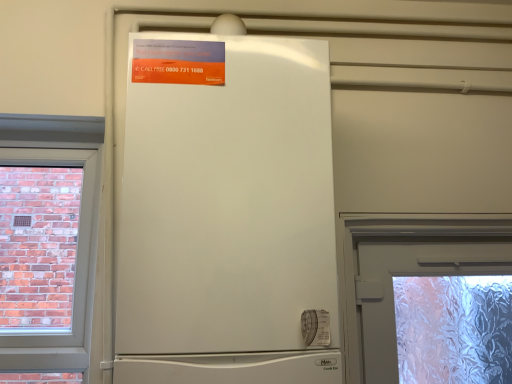
Question: Is white matte refrigerator at center positioned beyond the bounds of orange glossy poster at upper center?

Choices:
 (A) yes
 (B) no

Answer: (A)

Question: From the image's perspective, is white matte refrigerator at center located beneath orange glossy poster at upper center?

Choices:
 (A) no
 (B) yes

Answer: (B)

Question: Considering the relative sizes of white matte refrigerator at center and orange glossy poster at upper center in the image provided, is white matte refrigerator at center taller than orange glossy poster at upper center?

Choices:
 (A) no
 (B) yes

Answer: (B)

Question: Is white matte refrigerator at center further to camera compared to orange glossy poster at upper center?

Choices:
 (A) no
 (B) yes

Answer: (A)

Question: Can you confirm if white matte refrigerator at center is wider than orange glossy poster at upper center?

Choices:
 (A) yes
 (B) no

Answer: (A)

Question: Would you say orange glossy poster at upper center is part of white matte refrigerator at center's contents?

Choices:
 (A) yes
 (B) no

Answer: (A)

Question: From a real-world perspective, is orange glossy poster at upper center physically above white matte refrigerator at center?

Choices:
 (A) no
 (B) yes

Answer: (B)

Question: Can you confirm if orange glossy poster at upper center is positioned to the right of white matte refrigerator at center?

Choices:
 (A) yes
 (B) no

Answer: (B)

Question: Does orange glossy poster at upper center have a greater height compared to white matte refrigerator at center?

Choices:
 (A) yes
 (B) no

Answer: (B)

Question: Is orange glossy poster at upper center positioned far away from white matte refrigerator at center?

Choices:
 (A) no
 (B) yes

Answer: (A)

Question: Is orange glossy poster at upper center smaller than white matte refrigerator at center?

Choices:
 (A) no
 (B) yes

Answer: (B)

Question: From the image's perspective, is orange glossy poster at upper center above white matte refrigerator at center?

Choices:
 (A) yes
 (B) no

Answer: (A)

Question: Is point (174, 74) positioned closer to the camera than point (126, 147)?

Choices:
 (A) closer
 (B) farther

Answer: (B)